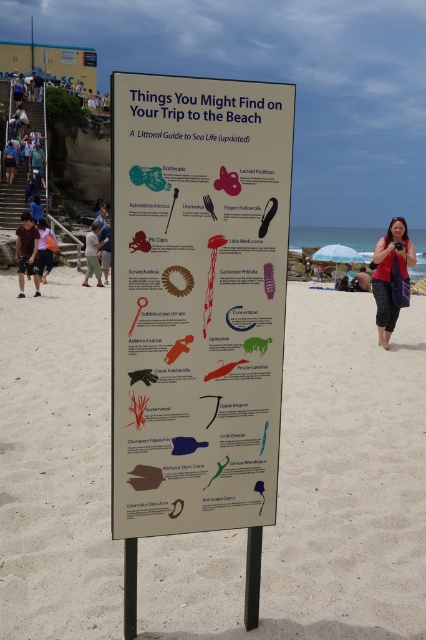
Question: Which object appears closest to the camera in this image?

Choices:
 (A) red fabric bag at center
 (B) matte pink shirt at center

Answer: (B)

Question: In this image, where is red fabric bag at right located relative to brown cotton shorts at lower left?

Choices:
 (A) above
 (B) below

Answer: (B)

Question: Does white paper sign at center appear on the left side of red fabric bag at center?

Choices:
 (A) yes
 (B) no

Answer: (A)

Question: Which point is closer to the camera taking this photo?

Choices:
 (A) (29, 241)
 (B) (388, 252)

Answer: (B)

Question: Which of the following is the closest to the observer?

Choices:
 (A) brown cotton shorts at lower left
 (B) light brown fabric pants at center
 (C) white sand at center

Answer: (C)

Question: Does brown cotton shorts at lower left have a greater width compared to denim pants at left?

Choices:
 (A) no
 (B) yes

Answer: (A)